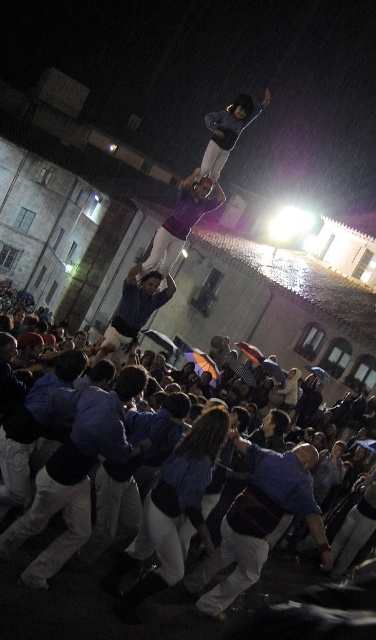
Can you confirm if blue shirt at center is thinner than matte black skateboard at upper center?

Yes.

Looking at this image, is blue shirt at center to the right of matte black skateboard at upper center from the viewer's perspective?

Incorrect, blue shirt at center is not on the right side of matte black skateboard at upper center.

Measure the distance between blue shirt at center and camera.

blue shirt at center is 36.53 meters away from camera.

I want to click on blue shirt at center, so click(x=133, y=312).

From the picture: Does purple fabric at center come in front of matte black skateboard at upper center?

No.

At what (x,y) coordinates should I click in order to perform the action: click on purple fabric at center. Please return your answer as a coordinate pair (x, y). Looking at the image, I should click on 180,221.

Who is more distant from viewer, (195, 179) or (222, 145)?

The point (195, 179) is more distant.

The image size is (376, 640). I want to click on purple fabric at center, so click(x=180, y=221).

Does blue cotton shirt at center appear on the right side of blue cotton shirt at lower left?

Correct, you'll find blue cotton shirt at center to the right of blue cotton shirt at lower left.

Does blue cotton shirt at center lie in front of blue cotton shirt at lower left?

That is True.

Who is more distant from viewer, (x=71, y=577) or (x=71, y=541)?

Point (x=71, y=541)

What are the coordinates of `blue cotton shirt at center` in the screenshot? It's located at (66, 595).